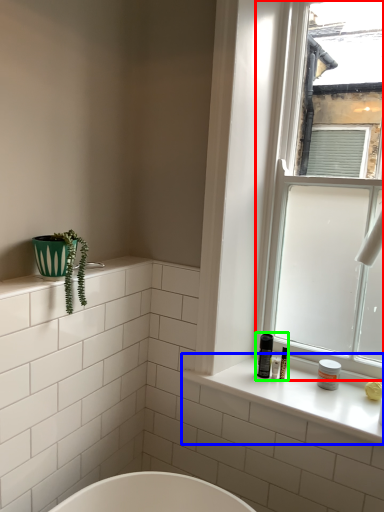
Question: Considering the real-world distances, which object is farthest from window (highlighted by a red box)? window sill (highlighted by a blue box) or toiletry (highlighted by a green box)?

Choices:
 (A) window sill
 (B) toiletry

Answer: (B)